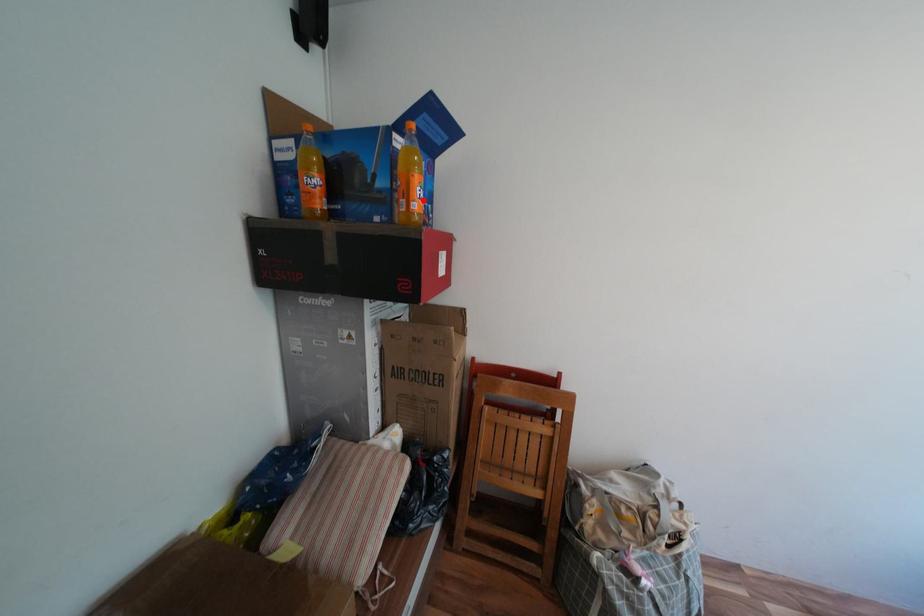
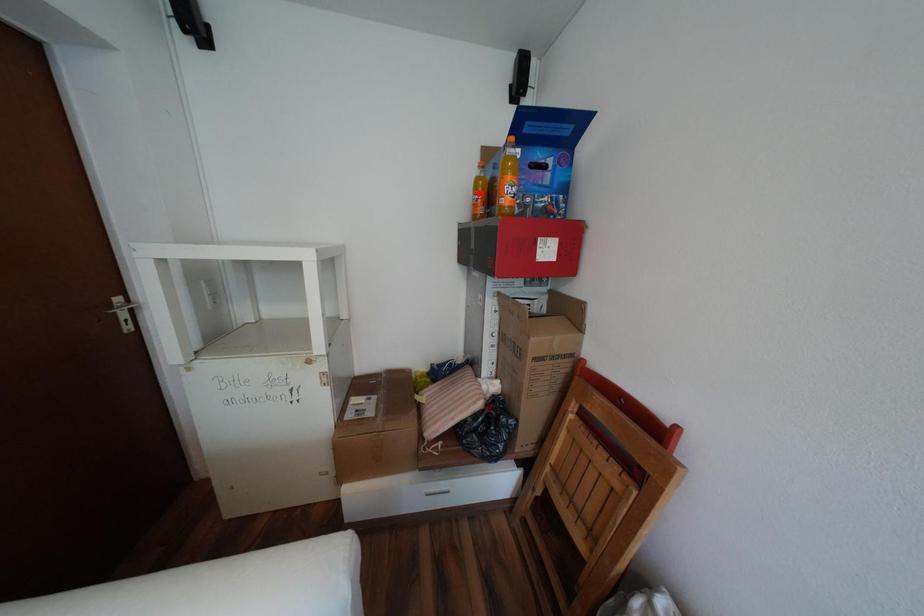
I am providing you with two images of the same scene from different viewpoints. A red point is marked on the first image and another point is marked on the second image. Is the marked point in image1 the same physical position as the marked point in image2?

No